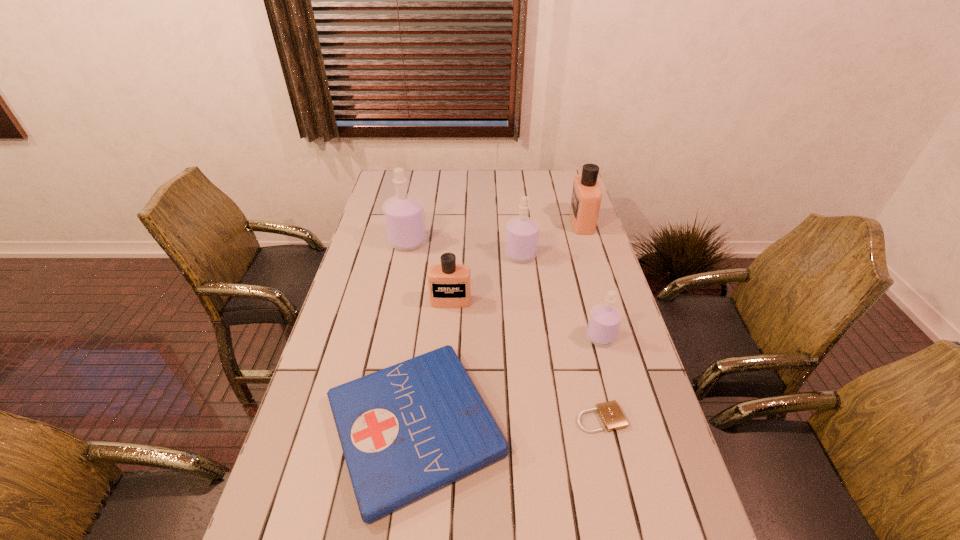
Find the location of a particular element. This screenshot has width=960, height=540. vacant region located 0.210m on the front label of the smaller beige perfume is located at coordinates (446, 361).

Locate an element on the screen. blank space located on the right of the second shortest object is located at coordinates (621, 426).

Image resolution: width=960 pixels, height=540 pixels. I want to click on free space located on the front of the shortest object, so click(x=617, y=492).

Identify the location of perfume at the left edge. The image size is (960, 540). (404, 216).

Where is `the first-aid kit at the left edge`? the first-aid kit at the left edge is located at coordinates (406, 431).

Where is `padlock situated at the right edge`? This screenshot has height=540, width=960. padlock situated at the right edge is located at coordinates (612, 417).

Find the location of a particular element. vacant area at the far edge of the desktop is located at coordinates (513, 191).

The image size is (960, 540). What are the coordinates of `vacant space at the left edge of the desktop` in the screenshot? It's located at (376, 331).

Where is `vacant space at the right edge of the desktop`? vacant space at the right edge of the desktop is located at coordinates (602, 252).

The height and width of the screenshot is (540, 960). In the image, there is a desktop. What are the coordinates of `vacant space at the far left corner` in the screenshot? It's located at (380, 195).